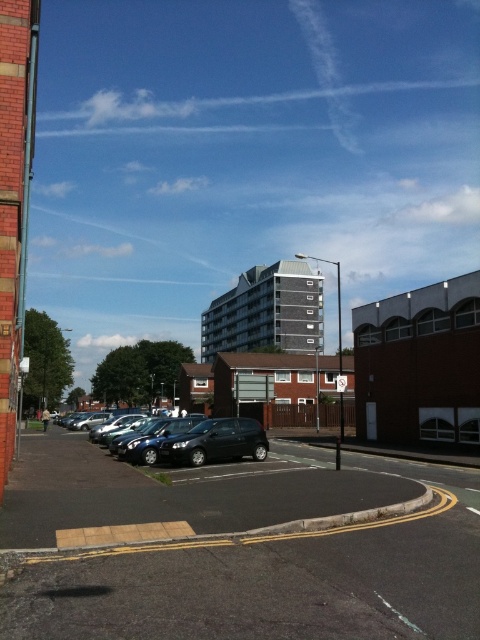
Question: Which of the following is the farthest from the observer?

Choices:
 (A) (188, 497)
 (B) (251, 436)

Answer: (B)

Question: Does black asphalt parking lot at center appear under shiny black car at center?

Choices:
 (A) no
 (B) yes

Answer: (A)

Question: Among these objects, which one is nearest to the camera?

Choices:
 (A) shiny black car at center
 (B) black asphalt parking lot at center

Answer: (B)

Question: Does black asphalt parking lot at center appear under shiny black car at center?

Choices:
 (A) yes
 (B) no

Answer: (B)

Question: Among these points, which one is nearest to the camera?

Choices:
 (A) (84, 632)
 (B) (256, 452)

Answer: (A)

Question: Is black asphalt parking lot at center positioned before shiny black car at center?

Choices:
 (A) yes
 (B) no

Answer: (A)